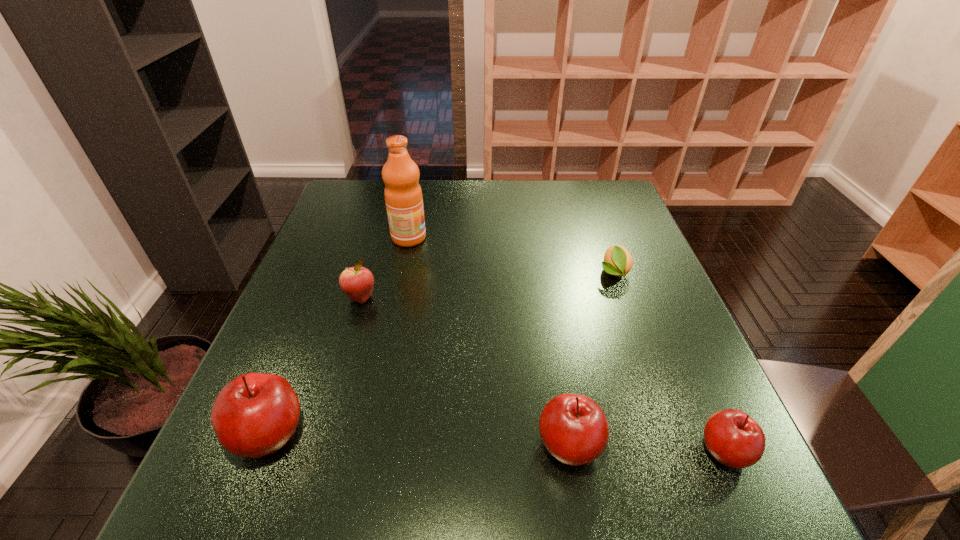
Please mark a free spot for a new apple to balance the arrangement. Please provide its 2D coordinates. Your answer should be formatted as a tuple, i.e. [(x, y)], where the tuple contains the x and y coordinates of a point satisfying the conditions above.

[(418, 440)]